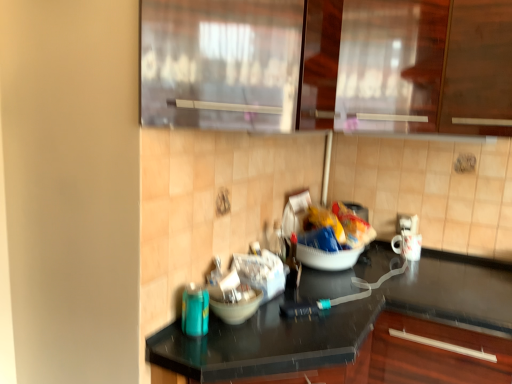
Question: Is transparent glass cabinet at upper center, the first glass door when ordered from back to front, positioned with its back to matte white bowl at center?

Choices:
 (A) yes
 (B) no

Answer: (B)

Question: Does transparent glass cabinet at upper center, the first glass door when ordered from back to front, have a lesser height compared to matte white bowl at center?

Choices:
 (A) yes
 (B) no

Answer: (B)

Question: From a real-world perspective, is transparent glass cabinet at upper center, the first glass door when ordered from back to front, positioned under matte white bowl at center based on gravity?

Choices:
 (A) no
 (B) yes

Answer: (A)

Question: Is transparent glass cabinet at upper center, marked as the 2th glass door in a front-to-back arrangement, oriented towards matte white bowl at center?

Choices:
 (A) yes
 (B) no

Answer: (B)

Question: Is transparent glass cabinet at upper center, marked as the 2th glass door in a front-to-back arrangement, far from matte white bowl at center?

Choices:
 (A) yes
 (B) no

Answer: (B)

Question: Is transparent glass cabinet at upper center, the first glass door when ordered from back to front, outside of matte white bowl at center?

Choices:
 (A) yes
 (B) no

Answer: (A)

Question: Considering the relative sizes of white glossy mug at right and transparent glass door at upper center, the first glass door viewed from the front, in the image provided, is white glossy mug at right thinner than transparent glass door at upper center, the first glass door viewed from the front,?

Choices:
 (A) yes
 (B) no

Answer: (A)

Question: Is transparent glass door at upper center, acting as the second glass door starting from the back, at the back of white glossy mug at right?

Choices:
 (A) yes
 (B) no

Answer: (B)

Question: Is white glossy mug at right positioned before transparent glass door at upper center, acting as the second glass door starting from the back?

Choices:
 (A) no
 (B) yes

Answer: (A)

Question: From a real-world perspective, is white glossy mug at right beneath transparent glass door at upper center, acting as the second glass door starting from the back?

Choices:
 (A) no
 (B) yes

Answer: (B)

Question: Is white glossy mug at right bigger than transparent glass door at upper center, acting as the second glass door starting from the back?

Choices:
 (A) no
 (B) yes

Answer: (A)

Question: Is white glossy mug at right at the right side of transparent glass door at upper center, the first glass door viewed from the front?

Choices:
 (A) no
 (B) yes

Answer: (B)

Question: Is black glossy countertop at center bigger than transparent glass door at upper center, acting as the second glass door starting from the back?

Choices:
 (A) yes
 (B) no

Answer: (A)